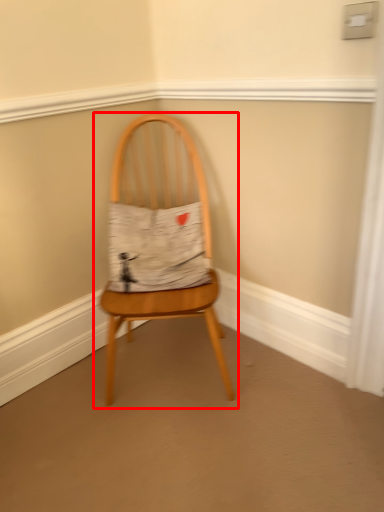
Question: Where is chair (annotated by the red box) located in relation to fabric in the image?

Choices:
 (A) right
 (B) left

Answer: (A)